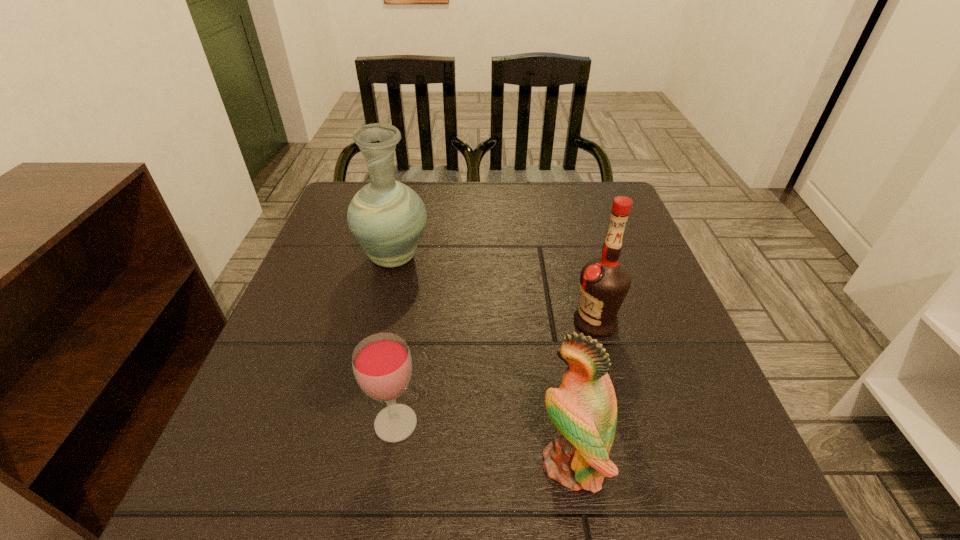
In the image, there is a desktop. At what (x,y) coordinates should I click in order to perform the action: click on vacant area at the right edge. Please return your answer as a coordinate pair (x, y). The width and height of the screenshot is (960, 540). Looking at the image, I should click on (633, 341).

This screenshot has width=960, height=540. Find the location of `vacant space at the far left corner of the desktop`. vacant space at the far left corner of the desktop is located at coordinates (333, 204).

In the image, there is a desktop. Identify the location of vacant space at the far right corner. (580, 188).

The height and width of the screenshot is (540, 960). Identify the location of free spot between the shortest object and the parrot. (484, 443).

Find the location of a particular element. This screenshot has height=540, width=960. empty location between the farthest object and the parrot is located at coordinates (483, 360).

The image size is (960, 540). I want to click on free space between the liquor and the pitcher, so click(x=494, y=290).

The height and width of the screenshot is (540, 960). In order to click on free spot between the farthest object and the liquor in this screenshot , I will do `click(494, 290)`.

The width and height of the screenshot is (960, 540). Find the location of `vacant space that is in between the farthest object and the liquor`. vacant space that is in between the farthest object and the liquor is located at coordinates (494, 290).

In order to click on empty location between the farthest object and the third nearest object in this screenshot , I will do `click(494, 290)`.

Select which object is the closest to the farthest object. Please provide its 2D coordinates. Your answer should be formatted as a tuple, i.e. [(x, y)], where the tuple contains the x and y coordinates of a point satisfying the conditions above.

[(382, 364)]